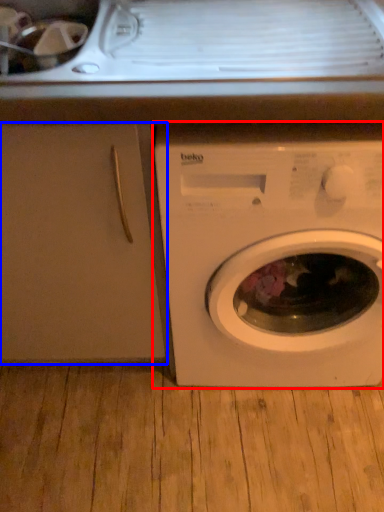
Question: Which object is further to the camera taking this photo, washing machine (highlighted by a red box) or screen door (highlighted by a blue box)?

Choices:
 (A) washing machine
 (B) screen door

Answer: (B)